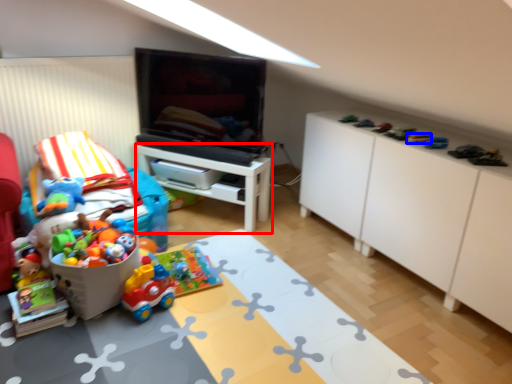
Question: Which object appears farthest to the camera in this image, table (highlighted by a red box) or toy (highlighted by a blue box)?

Choices:
 (A) table
 (B) toy

Answer: (A)